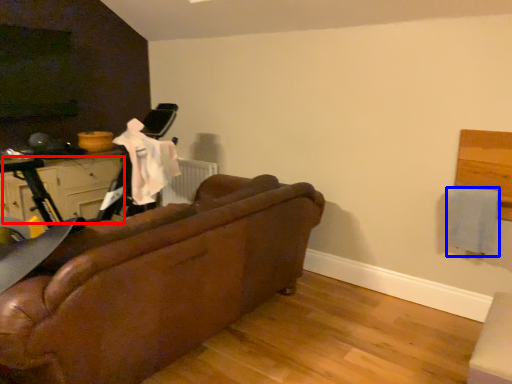
Question: Among these objects, which one is farthest to the camera, drawer (highlighted by a red box) or clothe (highlighted by a blue box)?

Choices:
 (A) drawer
 (B) clothe

Answer: (A)